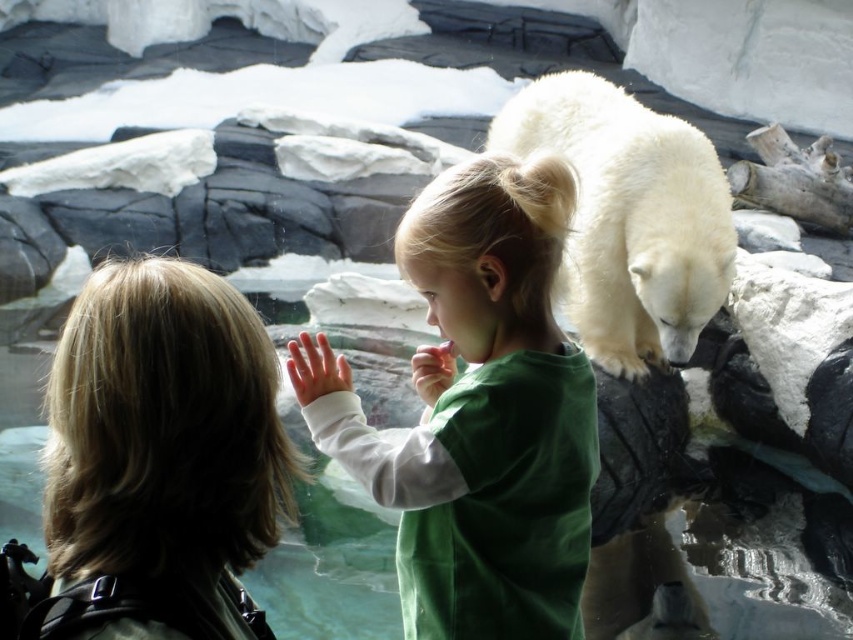
Question: Which object appears farthest from the camera in this image?

Choices:
 (A) green cotton shirt at center
 (B) white fluffy polar bear at upper right

Answer: (B)

Question: Among these points, which one is nearest to the camera?

Choices:
 (A) (427, 516)
 (B) (706, 259)

Answer: (A)

Question: In this image, where is green cotton shirt at center located relative to white fluffy polar bear at upper right?

Choices:
 (A) left
 (B) right

Answer: (A)

Question: Does green cotton shirt at center appear over white fluffy polar bear at upper right?

Choices:
 (A) yes
 (B) no

Answer: (B)

Question: Where is green cotton shirt at center located in relation to white fluffy polar bear at upper right in the image?

Choices:
 (A) right
 (B) left

Answer: (B)